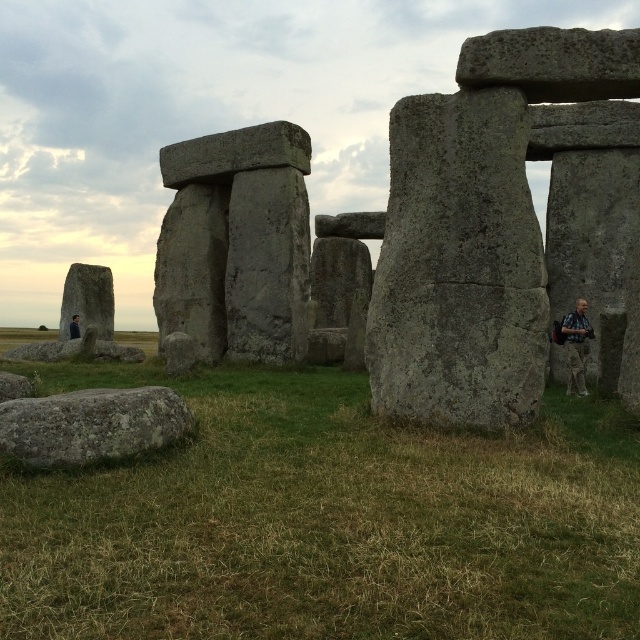
You are planning to set up a small tent for a photography session at Stonehenge. The tent requires a flat area wider than the gray rough boulder at lower left. Based on the scene, can the green grass at center provide enough width for your tent?

The green grass at center is wider than the gray rough boulder at lower left, so it can accommodate the tent requiring a flat area wider than the boulder.

Based on the photo, you are a photographer planning to capture a wide shot of the gray stone monolith at center and the camouflage fabric jacket at lower right. Which object will appear wider in the photo?

The gray stone monolith at center will appear wider in the photo because its width surpasses that of the camouflage fabric jacket at lower right.

You are a tour guide explaining Stonehenge to visitors. You point out the green grass at center and the gray stone structure at center. Which one is taller in this part of the monument?

The gray stone structure at center is taller than the green grass at center.